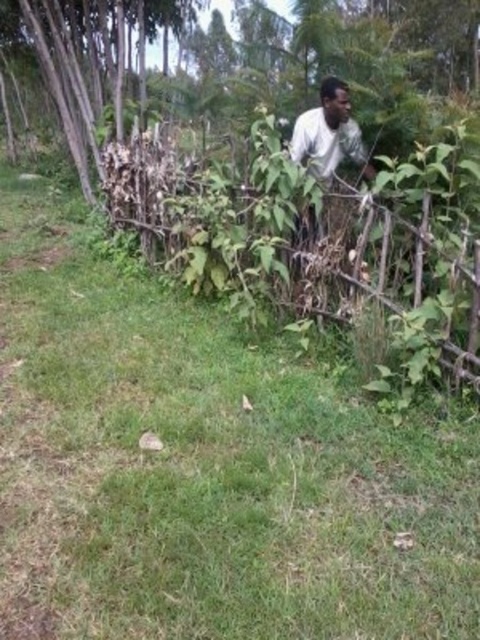
Question: Does brown dry wood at left appear over white matte shirt at center?

Choices:
 (A) no
 (B) yes

Answer: (B)

Question: Which point is closer to the camera?

Choices:
 (A) brown dry wood at left
 (B) white matte shirt at center

Answer: (B)

Question: Does brown dry wood at left appear over white matte shirt at center?

Choices:
 (A) no
 (B) yes

Answer: (B)

Question: Is brown dry wood at left smaller than white matte shirt at center?

Choices:
 (A) yes
 (B) no

Answer: (B)

Question: Among these objects, which one is nearest to the camera?

Choices:
 (A) brown dry wood at left
 (B) white matte shirt at center

Answer: (B)